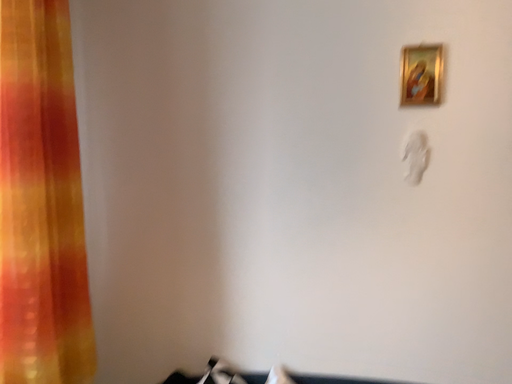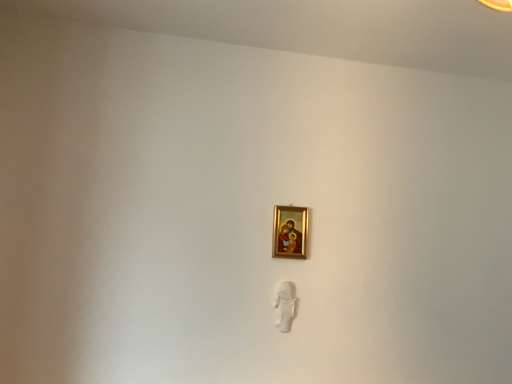
Question: How did the camera likely rotate when shooting the video?

Choices:
 (A) rotated downward
 (B) rotated upward

Answer: (B)